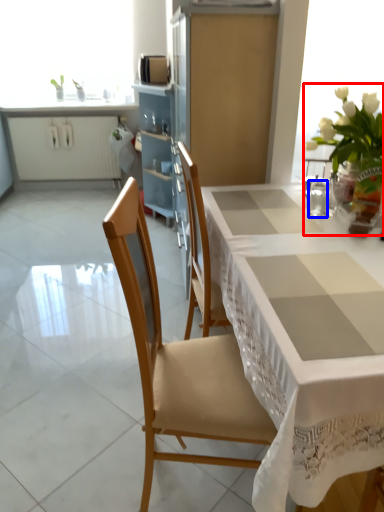
Question: Among these objects, which one is farthest to the camera, floral arrangement (highlighted by a red box) or tableware (highlighted by a blue box)?

Choices:
 (A) floral arrangement
 (B) tableware

Answer: (B)